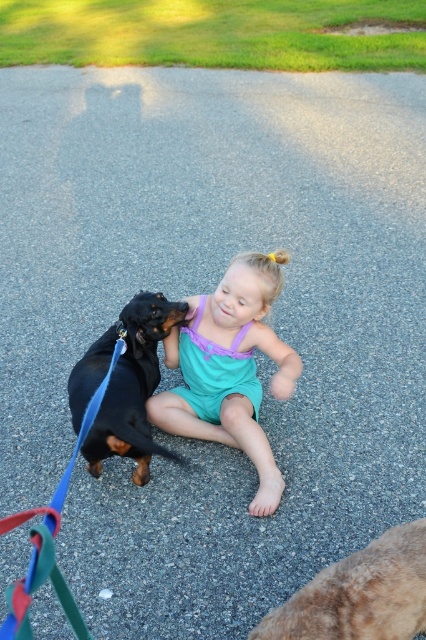
Question: Which of the following is the closest to the observer?

Choices:
 (A) matte teal swimsuit at center
 (B) black smooth dachshund at center

Answer: (B)

Question: Is brown fluffy dog at lower right further to camera compared to black smooth dachshund at center?

Choices:
 (A) no
 (B) yes

Answer: (A)

Question: Among these points, which one is farthest from the camera?

Choices:
 (A) (235, 412)
 (B) (362, 561)

Answer: (A)

Question: Where is matte teal swimsuit at center located in relation to brown fluffy dog at lower right in the image?

Choices:
 (A) left
 (B) right

Answer: (A)

Question: Which point is farther from the camera taking this photo?

Choices:
 (A) [x=397, y=609]
 (B) [x=100, y=365]

Answer: (B)

Question: Considering the relative positions of brown fluffy dog at lower right and black smooth dachshund at center in the image provided, where is brown fluffy dog at lower right located with respect to black smooth dachshund at center?

Choices:
 (A) left
 (B) right

Answer: (B)